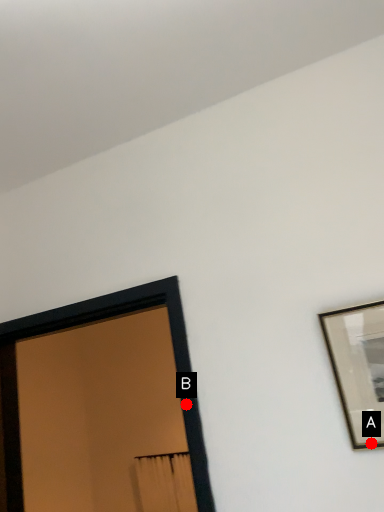
Question: Two points are circled on the image, labeled by A and B beside each circle. Among these points, which one is nearest to the camera?

Choices:
 (A) A is closer
 (B) B is closer

Answer: (A)